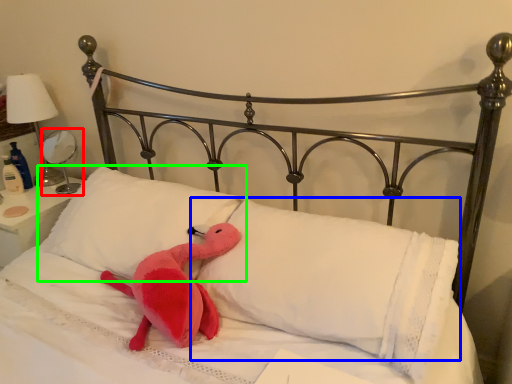
Question: Which object is positioned farthest from table lamp (highlighted by a red box)? Select from pillow (highlighted by a blue box) and pillow (highlighted by a green box).

Choices:
 (A) pillow
 (B) pillow

Answer: (A)